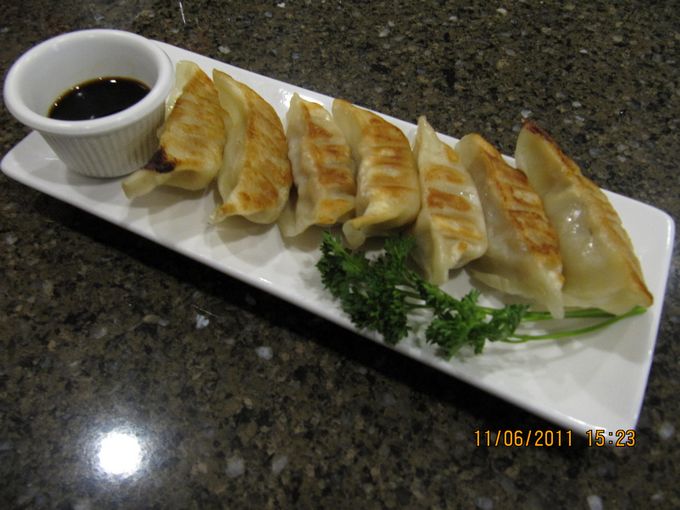
This screenshot has height=510, width=680. I want to click on cup, so click(x=99, y=148).